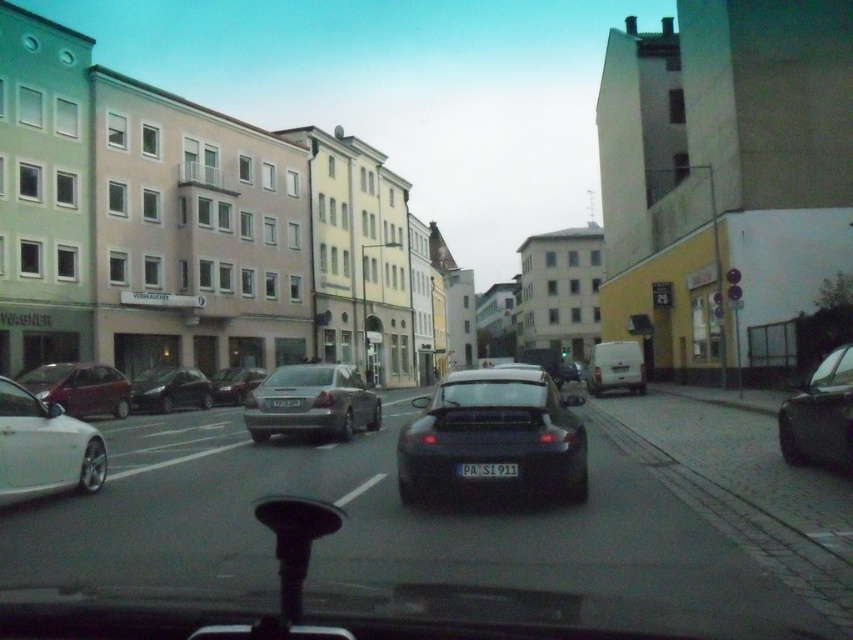
Question: Does satin black car at center have a smaller size compared to white matte van at right?

Choices:
 (A) yes
 (B) no

Answer: (B)

Question: Which object is positioned farthest from the shiny white car at left?

Choices:
 (A) white matte van at right
 (B) black plastic license plate at center

Answer: (A)

Question: Is shiny black sedan at center-left closer to the viewer compared to white matte van at right?

Choices:
 (A) no
 (B) yes

Answer: (B)

Question: Estimate the real-world distances between objects in this image. Which object is closer to the satin silver sedan at center?

Choices:
 (A) white matte van at right
 (B) satin black sedan at center
 (C) shiny white car at left

Answer: (B)

Question: Among these objects, which one is farthest from the camera?

Choices:
 (A) black plastic license plate at center
 (B) white plastic license plate at center
 (C) satin black sedan at center
 (D) shiny black sedan at center-left

Answer: (C)

Question: Is shiny white car at left above satin silver sedan at center?

Choices:
 (A) yes
 (B) no

Answer: (A)